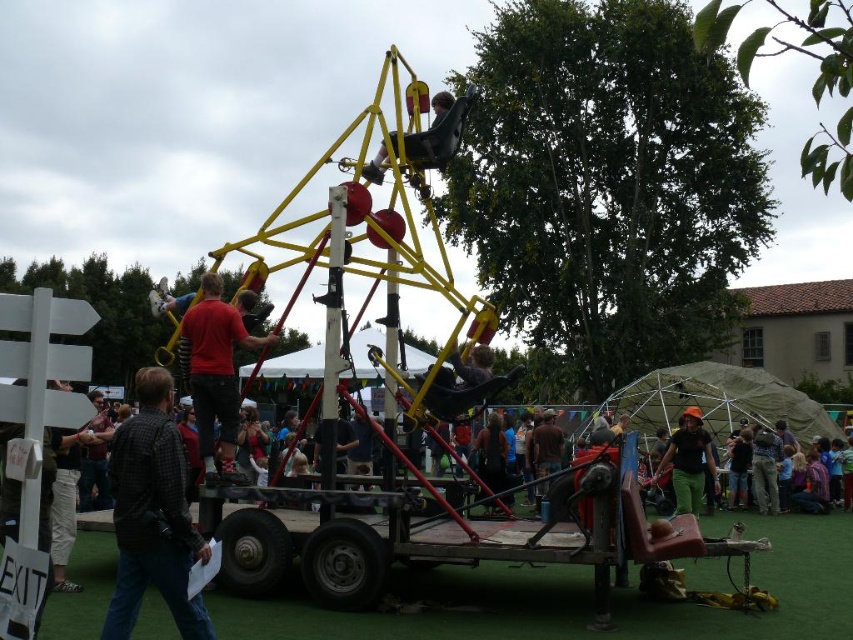
Question: Among these objects, which one is nearest to the camera?

Choices:
 (A) green fabric hat at center
 (B) black checkered shirt at center

Answer: (B)

Question: Which is nearer to the green fabric hat at center?

Choices:
 (A) black checkered shirt at center
 (B) red shirt at center

Answer: (B)

Question: Can you confirm if black checkered shirt at center is positioned to the right of green fabric hat at center?

Choices:
 (A) no
 (B) yes

Answer: (A)

Question: Is black checkered shirt at center bigger than red shirt at center?

Choices:
 (A) yes
 (B) no

Answer: (A)

Question: Among these objects, which one is farthest from the camera?

Choices:
 (A) green fabric hat at center
 (B) red shirt at center

Answer: (A)

Question: Can you confirm if black checkered shirt at center is positioned to the right of green fabric hat at center?

Choices:
 (A) no
 (B) yes

Answer: (A)